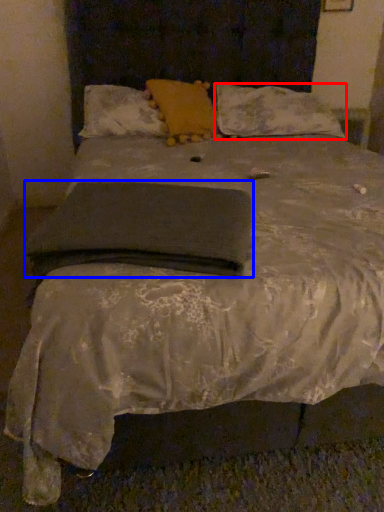
Question: Which point is further to the camera, pillow (highlighted by a red box) or pad (highlighted by a blue box)?

Choices:
 (A) pillow
 (B) pad

Answer: (A)